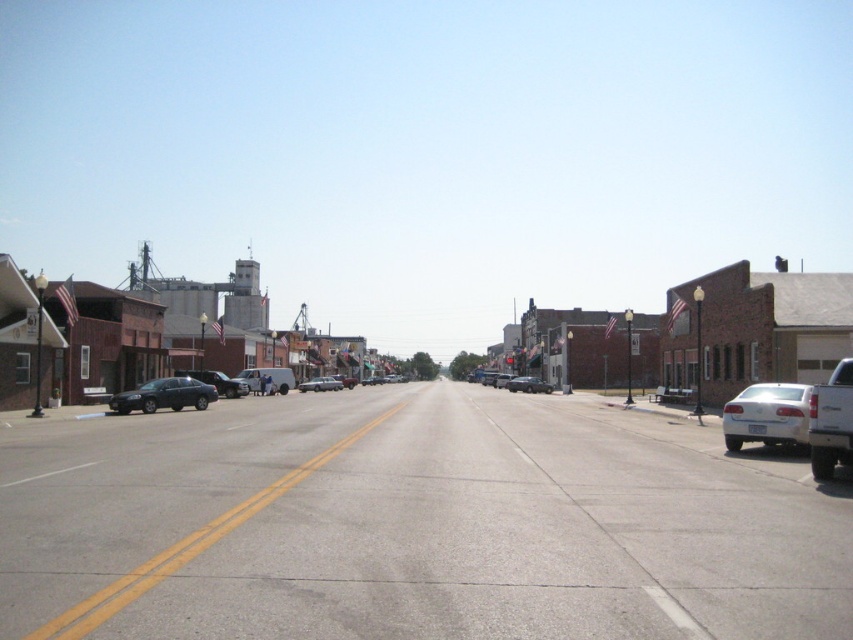
You are standing at the center of the road in this small town. You see a point at coordinates (164, 396). Which object is this point located on?

The point at coordinates (164, 396) is located on the matte black sedan at left.

You are a delivery driver who needs to park your truck between the matte black sedan at left and the satin black sedan at center. Your truck is 2.2 meters wide. Can you fit your truck between them?

The matte black sedan at left might be wider than satin black sedan at center, so the space between them could be narrower than expected. Since your truck is 2.2 meters wide, it is uncertain if there is enough space without more precise measurements.